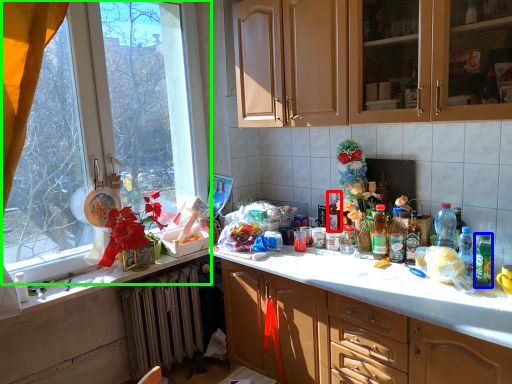
Question: Which object is the farthest from bottle (highlighted by a red box)? Choose among these: bottle (highlighted by a blue box) or window (highlighted by a green box).

Choices:
 (A) bottle
 (B) window

Answer: (B)